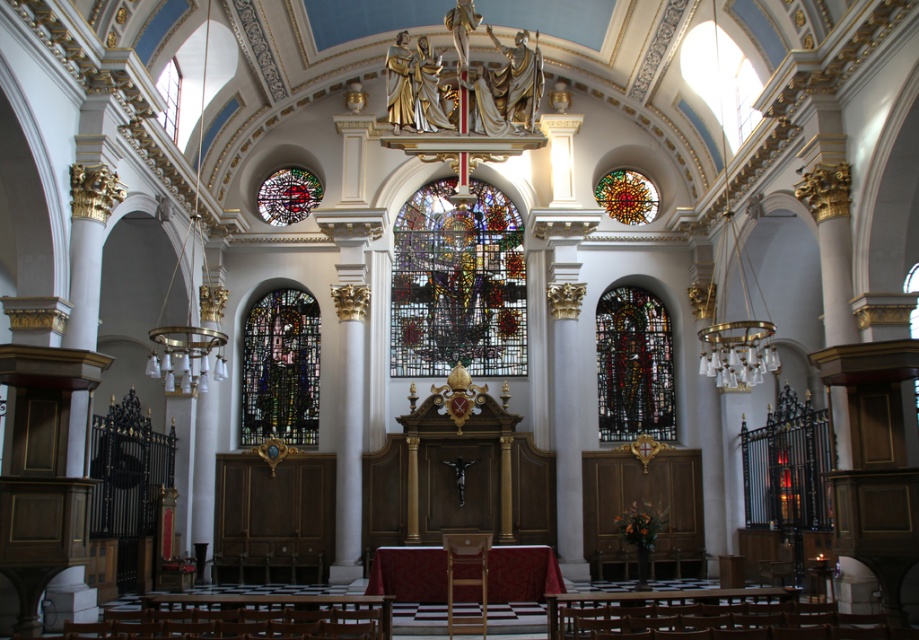
Consider the image. You are standing in the grand church and want to take a photo of the altar area. The camera you are using has a focal length of 50mm and a sensor size of 24mm x 36mm. The point at coordinates point (600, 342) is part of the altar area. Given that the distance from you to this point is 92.27 meters, what is the required sensor resolution in megapixels to capture the entire altar area in focus with a depth of field of 2 meters?

The required sensor resolution can be calculated using the formula...

You are an interior designer planning to install a new decorative element in the church. You have two options for placement. The first option is next to the stained glass window at center, and the second is next to the multicolored stained glass at upper center. Considering their sizes, which location would allow for a larger decorative element without overcrowding the space?

The stained glass window at center has a larger width than the multicolored stained glass at upper center, so placing the larger decorative element next to the stained glass window at center would be more appropriate to avoid overcrowding.